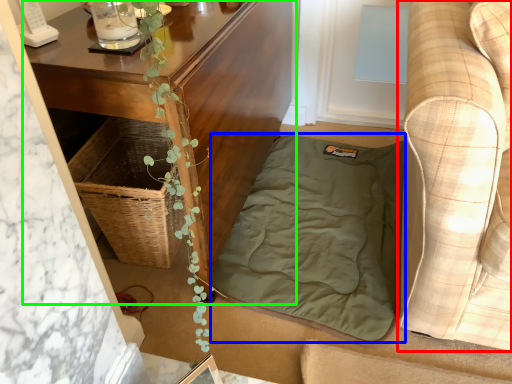
Question: Which is nearer to the studio couch (highlighted by a red box)? blanket (highlighted by a blue box) or table (highlighted by a green box).

Choices:
 (A) blanket
 (B) table

Answer: (A)